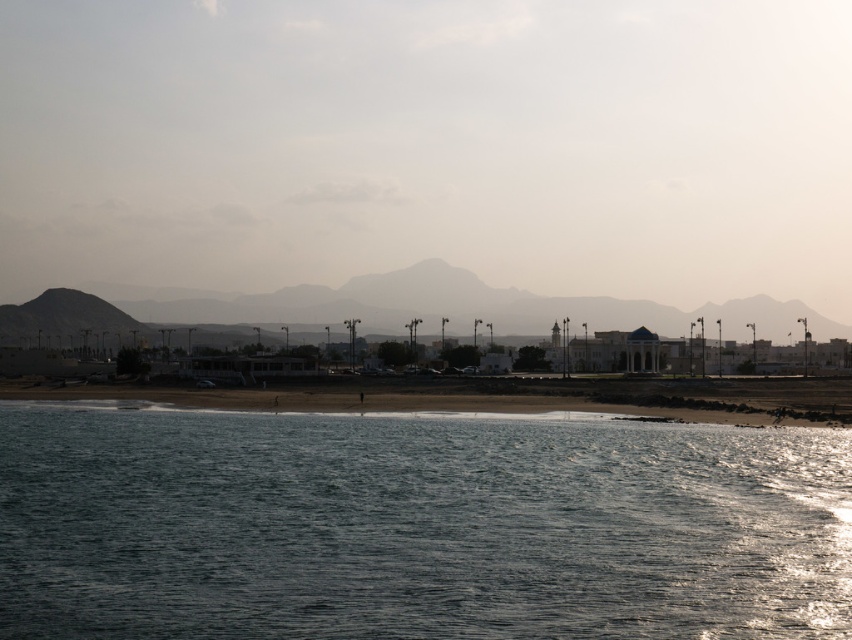
You are planning to take a photo of the shiny blue water at center and the sandy brown mountain at center. Which object is narrower in the scene?

The shiny blue water at center is narrower than the sandy brown mountain at center.

You are a hiker planning to take a photo of the sandy brown mountain at center and the sandy beach at lower center. Which object will appear bigger in your photo?

The sandy brown mountain at center will appear bigger in the photo because it has a larger size compared to the sandy beach at lower center according to the description.

You are standing on the sandy beach at lower center and want to climb the sandy brown mountain at center. Which direction should you head to reach the mountain?

To reach the sandy brown mountain at center from the sandy beach at lower center, you should head north since the mountain is located north of the beach according to the scene description.